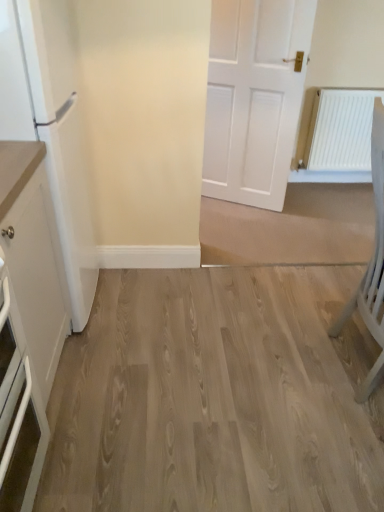
Question: Is light wood flooring at center inside or outside of light gray wooden chair at right?

Choices:
 (A) outside
 (B) inside

Answer: (A)

Question: From the image's perspective, relative to light gray wooden chair at right, is light wood flooring at center above or below?

Choices:
 (A) below
 (B) above

Answer: (A)

Question: Which object is the farthest from the white glossy refrigerator at left?

Choices:
 (A) white matte radiator at right
 (B) light gray wooden chair at right
 (C) white matte cabinet at left
 (D) light wood flooring at center

Answer: (A)

Question: Estimate the real-world distances between objects in this image. Which object is closer to the white glossy refrigerator at left?

Choices:
 (A) white matte cabinet at left
 (B) white matte radiator at right
 (C) light gray wooden chair at right
 (D) light wood flooring at center

Answer: (A)